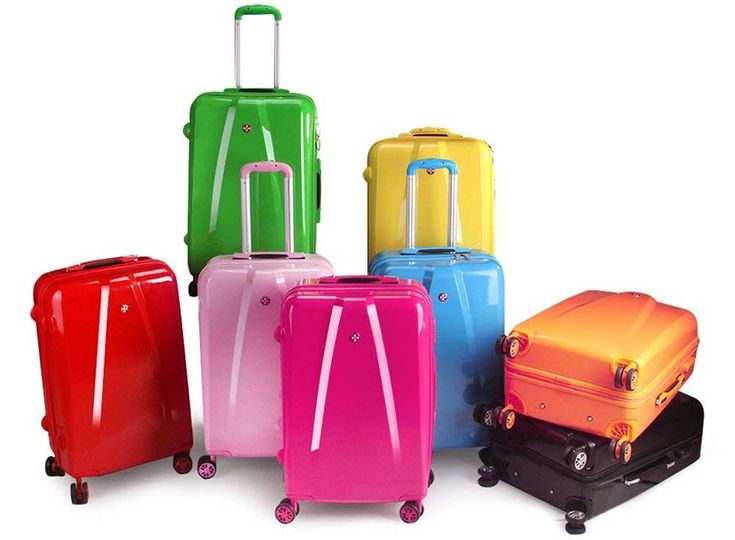
At what (x,y) coordinates should I click in order to perform the action: click on handle. Please return your answer as a coordinate pair (x, y). The height and width of the screenshot is (540, 735). Looking at the image, I should click on (258, 20), (278, 167), (436, 168), (428, 137), (95, 256).